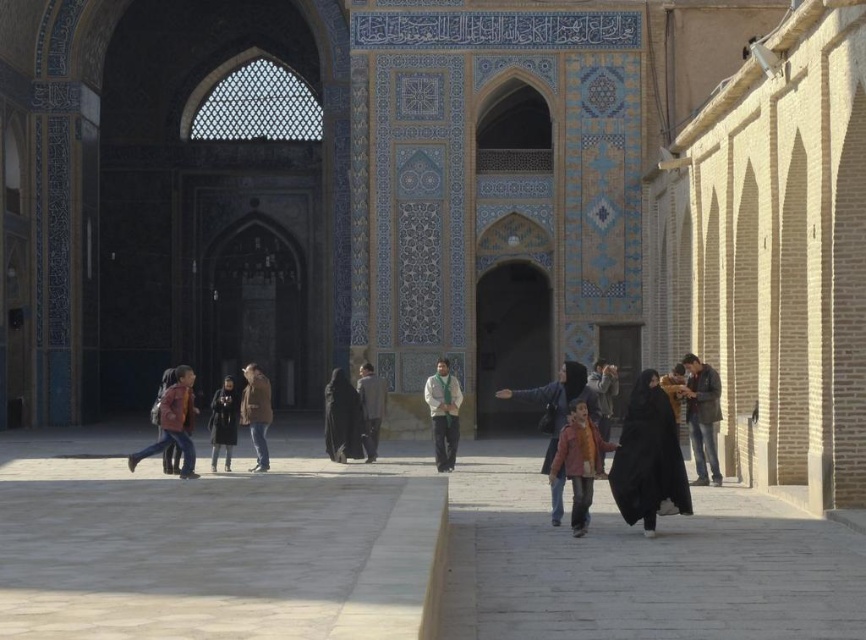
You are standing in the courtyard of a mosque and notice two items at the center. The black fabric at center and the light beige sweater at center. Which item is located to the right when facing the center of the courtyard?

The black fabric at center is positioned on the right side of the light beige sweater at center, so when facing the center of the courtyard, the black fabric at center is to the right of the light beige sweater at center.